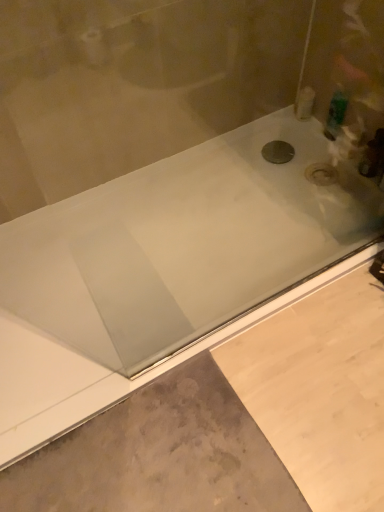
Where is `vacant space that is in between white plastic bottle at upper right, arranged as the first toiletry when viewed from the left, and black metallic drain at center`? This screenshot has width=384, height=512. vacant space that is in between white plastic bottle at upper right, arranged as the first toiletry when viewed from the left, and black metallic drain at center is located at coordinates (289, 138).